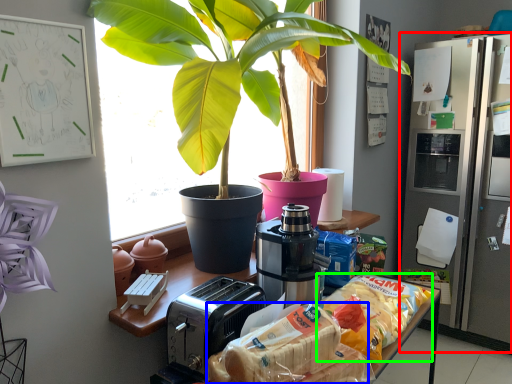
Question: Considering the real-world distances, which object is farthest from fridge (highlighted by a red box)? snack (highlighted by a blue box) or snack (highlighted by a green box)?

Choices:
 (A) snack
 (B) snack

Answer: (A)